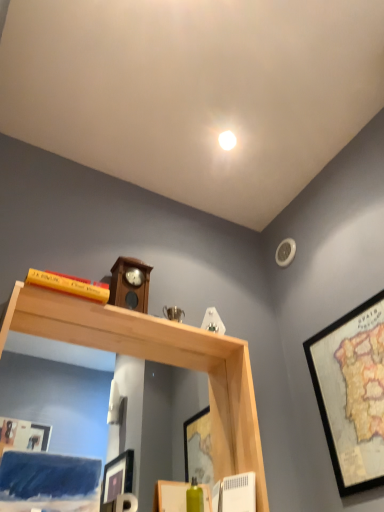
Measure the distance between point (x=87, y=287) and camera.

Point (x=87, y=287) and camera are 4.20 feet apart from each other.

You are a GUI agent. You are given a task and a screenshot of the screen. Output one action in this format:
    pyautogui.click(x=<x>, y=<y>)
    Task: Click on the wooden clock at center
    This screenshot has width=384, height=512.
    Given the screenshot: What is the action you would take?
    pyautogui.click(x=129, y=285)

Image resolution: width=384 pixels, height=512 pixels. Describe the element at coordinates (351, 393) in the screenshot. I see `wooden framed map at right` at that location.

Image resolution: width=384 pixels, height=512 pixels. I want to click on yellow matte bookshelf at upper left, so coord(68,285).

From the image's perspective, is natural wood mirror at upper center over wooden clock at center?

No, from the image's perspective, natural wood mirror at upper center is not on top of wooden clock at center.

Which object is positioned more to the right, natural wood mirror at upper center or wooden clock at center?

natural wood mirror at upper center.

Is point (236, 463) behind point (120, 295)?

No, it is in front of (120, 295).

From a real-world perspective, which object rests below the other?

natural wood mirror at upper center.

Can you tell me how much wooden clock at center and natural wood mirror at upper center differ in facing direction?

0.0393 degrees.

Between wooden clock at center and natural wood mirror at upper center, which one has more height?

Standing taller between the two is natural wood mirror at upper center.

Is wooden clock at center facing towards natural wood mirror at upper center?

No.

Which of these two, wooden clock at center or natural wood mirror at upper center, is thinner?

With smaller width is wooden clock at center.

Could you tell me if yellow matte bookshelf at upper left is turned towards wooden clock at center?

No, yellow matte bookshelf at upper left is not facing towards wooden clock at center.

From a real-world perspective, which object stands above the other?

wooden clock at center.

From the image's perspective, is yellow matte bookshelf at upper left positioned above or below wooden clock at center?

yellow matte bookshelf at upper left is situated higher than wooden clock at center in the image.

Who is taller, yellow matte bookshelf at upper left or wooden clock at center?

With more height is wooden clock at center.

Can you confirm if wooden framed map at right is thinner than natural wood mirror at upper center?

Correct, the width of wooden framed map at right is less than that of natural wood mirror at upper center.

From the picture: From a real-world perspective, which is physically below, wooden framed map at right or natural wood mirror at upper center?

natural wood mirror at upper center.

Which of these two, wooden framed map at right or natural wood mirror at upper center, stands taller?

Standing taller between the two is natural wood mirror at upper center.

Does point (378, 393) come closer to viewer compared to point (235, 454)?

That is True.

Does wooden clock at center have a greater height compared to yellow matte bookshelf at upper left?

Indeed, wooden clock at center has a greater height compared to yellow matte bookshelf at upper left.

Can you tell me how much wooden clock at center and yellow matte bookshelf at upper left differ in facing direction?

1.53 degrees separate the facing orientations of wooden clock at center and yellow matte bookshelf at upper left.

Is wooden clock at center next to yellow matte bookshelf at upper left?

No, wooden clock at center is not making contact with yellow matte bookshelf at upper left.

Is wooden clock at center positioned beyond the bounds of yellow matte bookshelf at upper left?

Yes.

Which object is positioned more to the left, yellow matte bookshelf at upper left or natural wood mirror at upper center?

yellow matte bookshelf at upper left.

How many degrees apart are the facing directions of yellow matte bookshelf at upper left and natural wood mirror at upper center?

They differ by 1.57 degrees in their facing directions.

Does point (78, 280) lie behind point (216, 420)?

No, (78, 280) is closer to viewer.

From a real-world perspective, is yellow matte bookshelf at upper left over wooden framed map at right?

Yes, from a real-world perspective, yellow matte bookshelf at upper left is above wooden framed map at right.

Who is smaller, yellow matte bookshelf at upper left or wooden framed map at right?

yellow matte bookshelf at upper left.

Is yellow matte bookshelf at upper left facing towards wooden framed map at right?

No, yellow matte bookshelf at upper left is not facing towards wooden framed map at right.

From their relative heights in the image, would you say yellow matte bookshelf at upper left is taller or shorter than wooden framed map at right?

In the image, yellow matte bookshelf at upper left appears to be shorter than wooden framed map at right.

In the image, there is a natural wood mirror at upper center. Where is `clock above it (from the image's perspective)`? The image size is (384, 512). clock above it (from the image's perspective) is located at coordinates (129, 285).

The width and height of the screenshot is (384, 512). In order to click on shelf that appears in front of the wooden clock at center in this screenshot , I will do `click(159, 362)`.

Considering their positions, is yellow matte bookshelf at upper left positioned closer to wooden clock at center than natural wood mirror at upper center?

Among the two, yellow matte bookshelf at upper left is located nearer to wooden clock at center.

Considering their positions, is wooden clock at center positioned further to wooden framed map at right than natural wood mirror at upper center?

wooden clock at center.

Based on their spatial positions, is wooden framed map at right or natural wood mirror at upper center closer to wooden clock at center?

natural wood mirror at upper center is closer to wooden clock at center.

Estimate the real-world distances between objects in this image. Which object is further from natural wood mirror at upper center, wooden framed map at right or yellow matte bookshelf at upper left?

wooden framed map at right lies further to natural wood mirror at upper center than the other object.

Based on their spatial positions, is wooden framed map at right or wooden clock at center further from yellow matte bookshelf at upper left?

wooden framed map at right is positioned further to the anchor yellow matte bookshelf at upper left.

Considering their positions, is natural wood mirror at upper center positioned closer to yellow matte bookshelf at upper left than wooden clock at center?

Based on the image, wooden clock at center appears to be nearer to yellow matte bookshelf at upper left.

When comparing their distances from wooden framed map at right, does natural wood mirror at upper center or yellow matte bookshelf at upper left seem further?

Based on the image, yellow matte bookshelf at upper left appears to be further to wooden framed map at right.

From the image, which object appears to be farther from wooden clock at center, wooden framed map at right or yellow matte bookshelf at upper left?

The object further to wooden clock at center is wooden framed map at right.

Identify the location of shelf between yellow matte bookshelf at upper left and wooden framed map at right from left to right. (159, 362).

This screenshot has width=384, height=512. In order to click on book located between natural wood mirror at upper center and wooden clock at center in the depth direction in this screenshot , I will do `click(68, 285)`.

You are a GUI agent. You are given a task and a screenshot of the screen. Output one action in this format:
    pyautogui.click(x=<x>, y=<y>)
    Task: Click on the clock situated between yellow matte bookshelf at upper left and wooden framed map at right from left to right
    The image size is (384, 512).
    Given the screenshot: What is the action you would take?
    pyautogui.click(x=129, y=285)

This screenshot has width=384, height=512. In order to click on shelf located between wooden clock at center and wooden framed map at right in the left-right direction in this screenshot , I will do `click(159, 362)`.